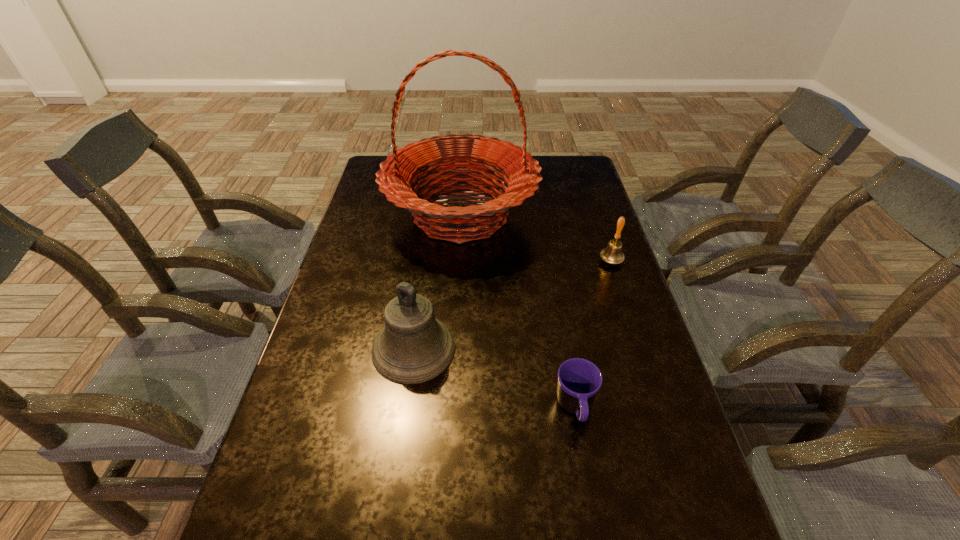
You are a GUI agent. You are given a task and a screenshot of the screen. Output one action in this format:
    pyautogui.click(x=<x>, y=<y>)
    Task: Click on the object that is at the far edge
    
    Given the screenshot: What is the action you would take?
    pyautogui.click(x=400, y=171)

Locate an element on the screen. The height and width of the screenshot is (540, 960). basket at the left edge is located at coordinates (400, 171).

Image resolution: width=960 pixels, height=540 pixels. I want to click on bell present at the left edge, so click(x=413, y=347).

The height and width of the screenshot is (540, 960). I want to click on object at the right edge, so click(x=612, y=254).

The image size is (960, 540). I want to click on object that is positioned at the far left corner, so tap(400, 171).

In the image, there is a desktop. Where is `vacant area at the left edge`? The width and height of the screenshot is (960, 540). vacant area at the left edge is located at coordinates pos(354,221).

Where is `vacant space at the right edge of the desktop`? The height and width of the screenshot is (540, 960). vacant space at the right edge of the desktop is located at coordinates (584, 266).

This screenshot has height=540, width=960. Identify the location of free space at the far left corner. (369, 177).

Locate an element on the screen. The image size is (960, 540). vacant space at the far right corner of the desktop is located at coordinates (589, 168).

At what (x,y) coordinates should I click in order to perform the action: click on free space between the second shortest object and the nearer bell. Please return your answer as a coordinate pair (x, y). Looking at the image, I should click on (513, 305).